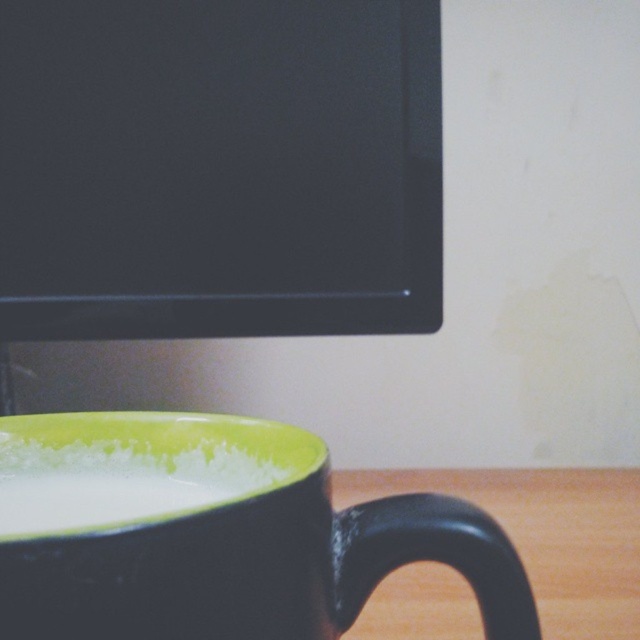
You are setting up a workspace and need to place a keyboard between the matte black monitor at upper left and the green matte mug at lower left. The keyboard is 10 inches wide. Can the keyboard fit between them?

The distance between the matte black monitor at upper left and the green matte mug at lower left is 9.94 inches, so the keyboard cannot fit between them as it is slightly wider than the available space.

You are setting up a desk and want to place the matte black monitor at upper left and green matte mug at lower left. According to the image, which object is positioned to the left of the other?

The matte black monitor at upper left is to the left of the green matte mug at lower left.